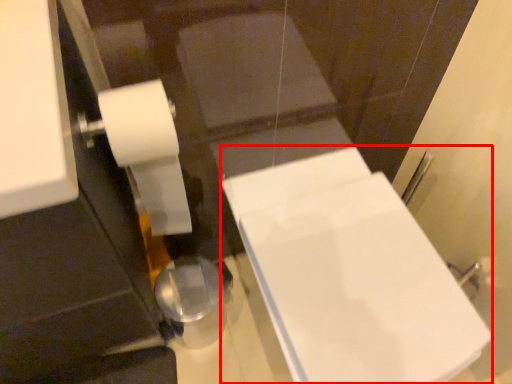
Question: From the image's perspective, what is the correct spatial relationship of bath (annotated by the red box) in relation to toilet paper?

Choices:
 (A) above
 (B) below

Answer: (B)